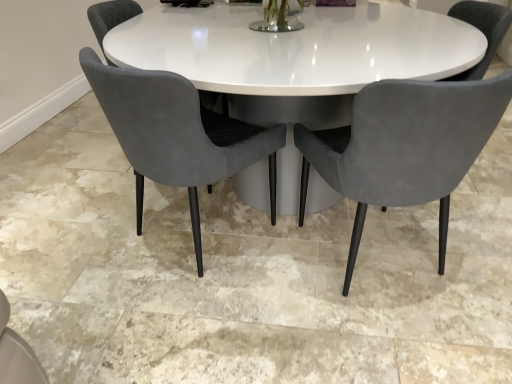
I want to click on vacant area that is in front of velvet grey chair at center, the 3th chair positioned from the left, so click(394, 346).